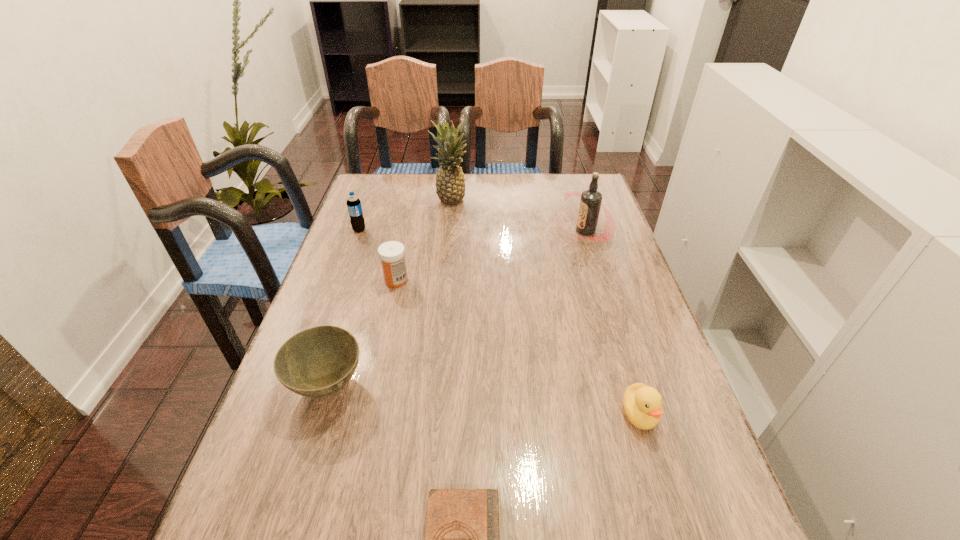
Identify which object is the closest to the bowl. Please provide its 2D coordinates. Your answer should be formatted as a tuple, i.e. [(x, y)], where the tuple contains the x and y coordinates of a point satisfying the conditions above.

[(462, 539)]

Identify the location of vacant space that satisfies the following two spatial constraints: 1. on the label of the root beer; 2. on the front side of the fourth farthest object. The width and height of the screenshot is (960, 540). (600, 280).

I want to click on free region that satisfies the following two spatial constraints: 1. on the back side of the third tallest object; 2. on the left side of the farthest object, so click(370, 201).